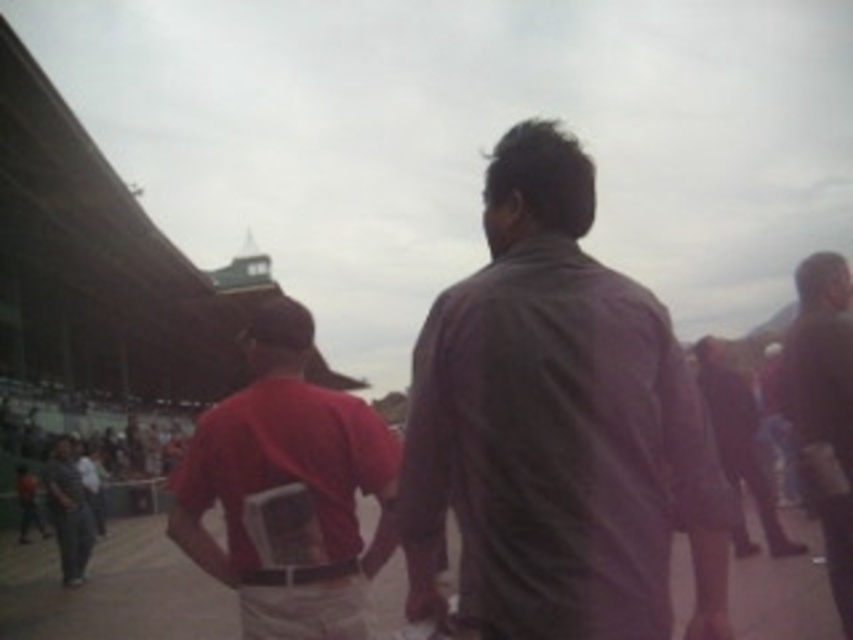
Who is shorter, matte red shirt at center or dark brown leather jacket at center?

dark brown leather jacket at center is shorter.

Does matte red shirt at center have a greater width compared to dark brown leather jacket at center?

No, matte red shirt at center is not wider than dark brown leather jacket at center.

Who is more distant from viewer, (363, 596) or (747, 410)?

Positioned behind is point (747, 410).

At what (x,y) coordinates should I click in order to perform the action: click on matte red shirt at center. Please return your answer as a coordinate pair (x, y). The height and width of the screenshot is (640, 853). Looking at the image, I should click on (288, 490).

Looking at this image, can you confirm if brown matte shirt at center is positioned to the left of dark gray fabric pants at lower left?

No, brown matte shirt at center is not to the left of dark gray fabric pants at lower left.

Is brown matte shirt at center above dark gray fabric pants at lower left?

Indeed, brown matte shirt at center is positioned over dark gray fabric pants at lower left.

You are a GUI agent. You are given a task and a screenshot of the screen. Output one action in this format:
    pyautogui.click(x=<x>, y=<y>)
    Task: Click on the brown matte shirt at center
    
    Given the screenshot: What is the action you would take?
    pyautogui.click(x=824, y=406)

Who is positioned more to the right, matte red shirt at center or dark gray fabric pants at lower left?

matte red shirt at center is more to the right.

Is matte red shirt at center above dark gray fabric pants at lower left?

Incorrect, matte red shirt at center is not positioned above dark gray fabric pants at lower left.

What do you see at coordinates (288, 490) in the screenshot? I see `matte red shirt at center` at bounding box center [288, 490].

Locate an element on the screen. This screenshot has width=853, height=640. matte red shirt at center is located at coordinates (288, 490).